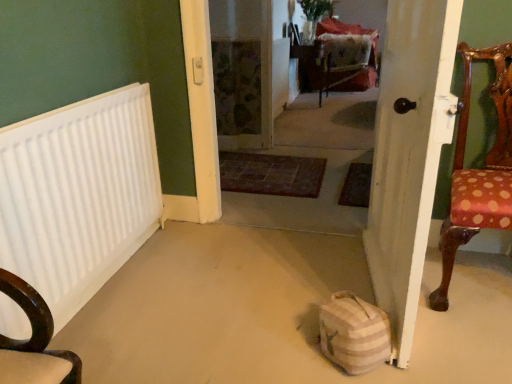
At what (x,y) coordinates should I click in order to perform the action: click on free space between white matte radiator at left and striped fabric bag at lower center. Please return your answer as a coordinate pair (x, y). The image size is (512, 384). Looking at the image, I should click on (199, 315).